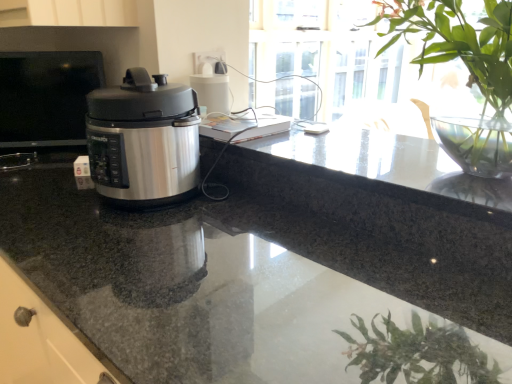
Question: Does granite countertop at center have a lesser width compared to metallic silver pressure cooker at left?

Choices:
 (A) yes
 (B) no

Answer: (B)

Question: Can you confirm if granite countertop at center is bigger than metallic silver pressure cooker at left?

Choices:
 (A) no
 (B) yes

Answer: (B)

Question: Is granite countertop at center to the right of metallic silver pressure cooker at left from the viewer's perspective?

Choices:
 (A) no
 (B) yes

Answer: (B)

Question: Is granite countertop at center positioned before metallic silver pressure cooker at left?

Choices:
 (A) yes
 (B) no

Answer: (A)

Question: Can you confirm if granite countertop at center is shorter than metallic silver pressure cooker at left?

Choices:
 (A) no
 (B) yes

Answer: (A)

Question: From the image's perspective, is granite countertop at center under metallic silver pressure cooker at left?

Choices:
 (A) no
 (B) yes

Answer: (B)

Question: Is green leafy plant at upper right positioned with its back to satin silver pressure cooker at left?

Choices:
 (A) no
 (B) yes

Answer: (A)

Question: Is green leafy plant at upper right positioned far away from satin silver pressure cooker at left?

Choices:
 (A) yes
 (B) no

Answer: (B)

Question: Is green leafy plant at upper right not inside satin silver pressure cooker at left?

Choices:
 (A) no
 (B) yes

Answer: (B)

Question: Is the position of green leafy plant at upper right more distant than that of satin silver pressure cooker at left?

Choices:
 (A) yes
 (B) no

Answer: (B)

Question: Is green leafy plant at upper right positioned before satin silver pressure cooker at left?

Choices:
 (A) yes
 (B) no

Answer: (A)

Question: From a real-world perspective, is green leafy plant at upper right on satin silver pressure cooker at left?

Choices:
 (A) yes
 (B) no

Answer: (A)

Question: Is granite countertop at center completely or partially inside metallic silver pressure cooker at left?

Choices:
 (A) no
 (B) yes

Answer: (A)